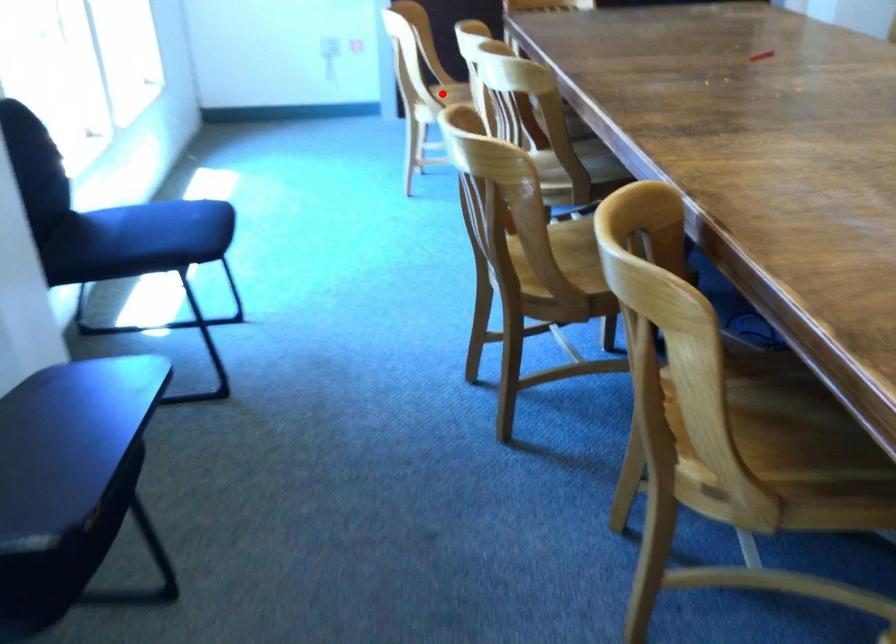
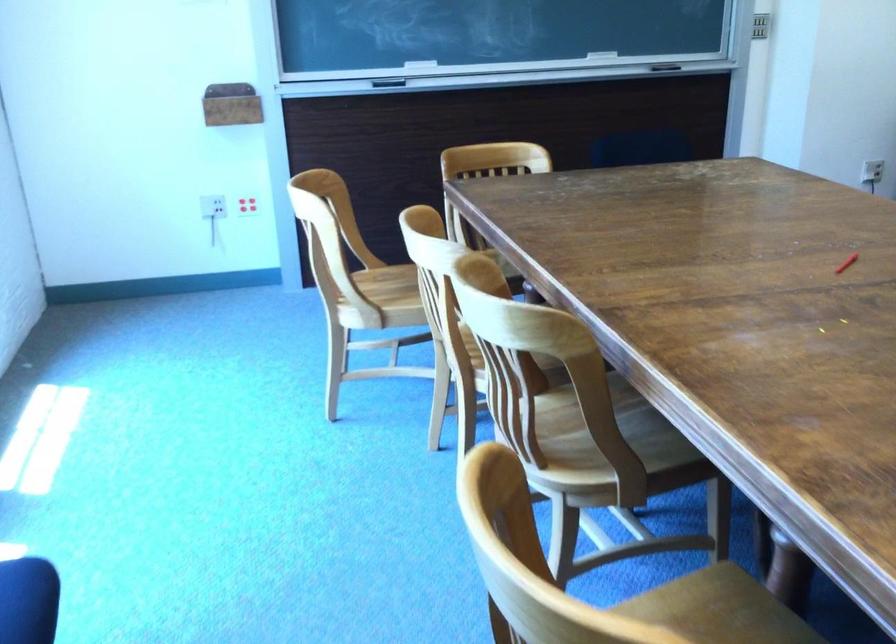
Locate, in the second image, the point that corresponds to the highlighted location in the first image.

(393, 286)